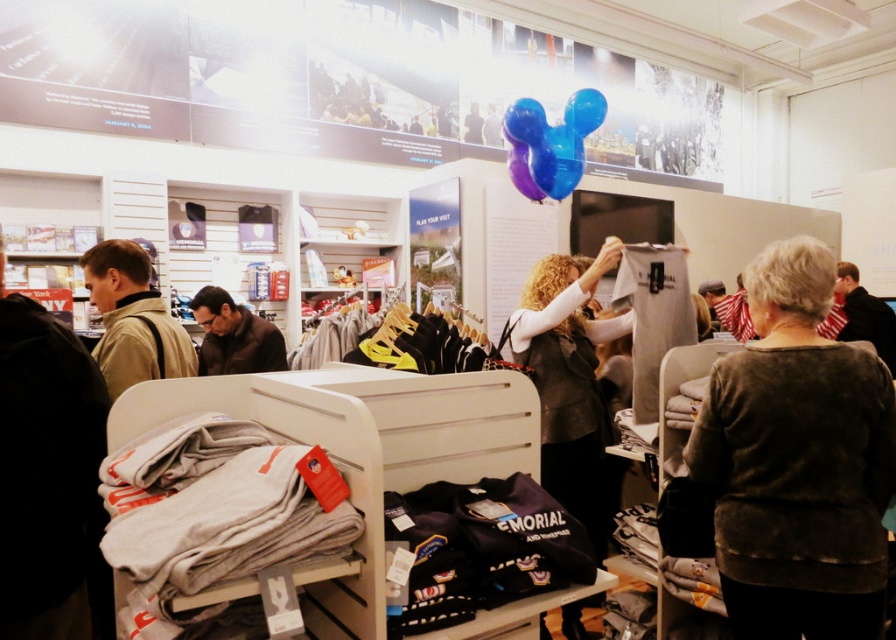
Question: Does black leather jacket at center appear on the left side of translucent blue balloon at upper center?

Choices:
 (A) yes
 (B) no

Answer: (A)

Question: Considering the real-world distances, which object is closest to the tan fabric jacket at left?

Choices:
 (A) translucent blue balloon at upper center
 (B) brown leather jacket at lower left
 (C) black leather jacket at center
 (D) dark gray sweater at center

Answer: (B)

Question: Is dark gray sweater at center further to camera compared to tan fabric jacket at left?

Choices:
 (A) no
 (B) yes

Answer: (A)

Question: Estimate the real-world distances between objects in this image. Which object is closer to the tan fabric jacket at left?

Choices:
 (A) dark gray sweater at center
 (B) translucent blue balloon at upper center
 (C) brown leather jacket at lower left
 (D) black leather jacket at center

Answer: (C)

Question: Is dark gray sweater at center thinner than black leather jacket at center?

Choices:
 (A) no
 (B) yes

Answer: (B)

Question: Estimate the real-world distances between objects in this image. Which object is farther from the brown leather jacket at lower left?

Choices:
 (A) translucent blue balloon at upper center
 (B) black leather jacket at center
 (C) tan fabric jacket at left

Answer: (A)